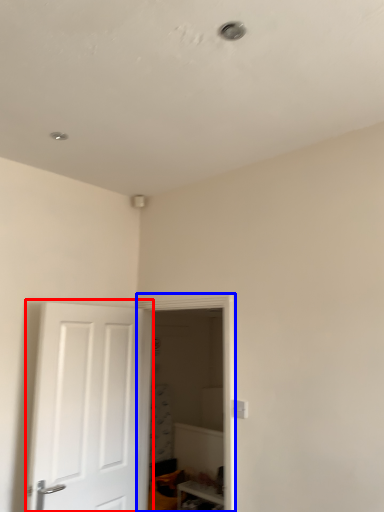
Question: Among these objects, which one is farthest to the camera, door (highlighted by a red box) or glass door (highlighted by a blue box)?

Choices:
 (A) door
 (B) glass door

Answer: (B)